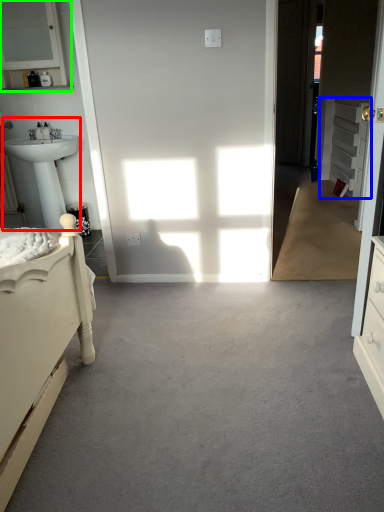
Question: Which object is the farthest from sink (highlighted by a red box)? Choose among these: cabinetry (highlighted by a blue box) or medicine cabinet (highlighted by a green box).

Choices:
 (A) cabinetry
 (B) medicine cabinet

Answer: (A)